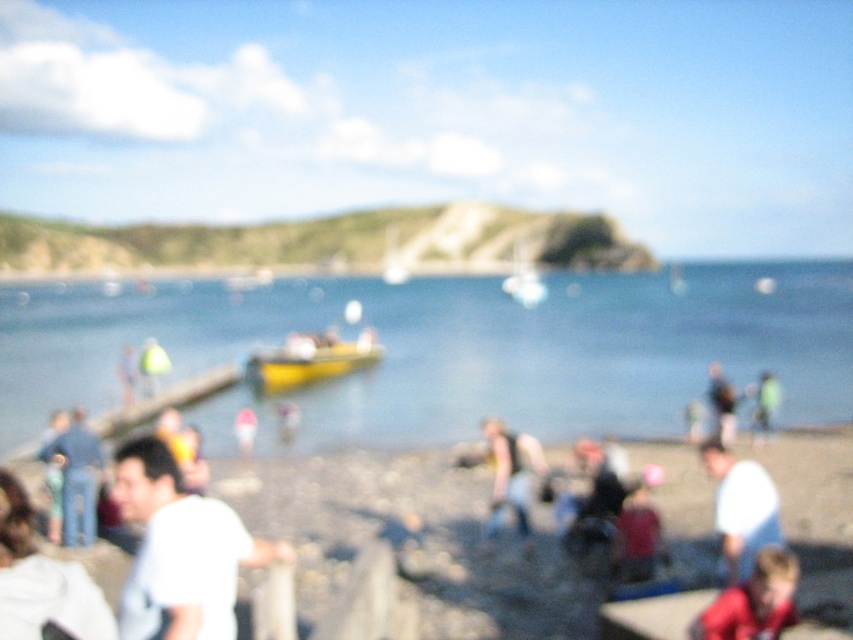
Can you confirm if dark brown leather jacket at center is taller than light blue shirt at center?

No.

Is point (490, 518) closer to viewer compared to point (129, 392)?

Yes, it is in front of point (129, 392).

This screenshot has height=640, width=853. In order to click on dark brown leather jacket at center in this screenshot , I will do 511,474.

Does point (816, 307) lie in front of point (144, 440)?

That is False.

In the scene shown: Which is below, blue water at center or white matte shirt at lower left?

white matte shirt at lower left is lower down.

Measure the distance between blue water at center and camera.

blue water at center is 129.70 feet away from camera.

Where is `blue water at center`? blue water at center is located at coordinates (457, 348).

Can you confirm if white cotton shirt at lower right is bigger than red fabric jacket at lower right?

Yes.

Who is more distant from viewer, (746,552) or (753,604)?

Point (746,552)

Is point (776, 504) less distant than point (730, 637)?

No, it is not.

You are a GUI agent. You are given a task and a screenshot of the screen. Output one action in this format:
    pyautogui.click(x=<x>, y=<y>)
    Task: Click on the white cotton shirt at lower right
    Image resolution: width=853 pixels, height=640 pixels.
    Given the screenshot: What is the action you would take?
    pyautogui.click(x=740, y=508)